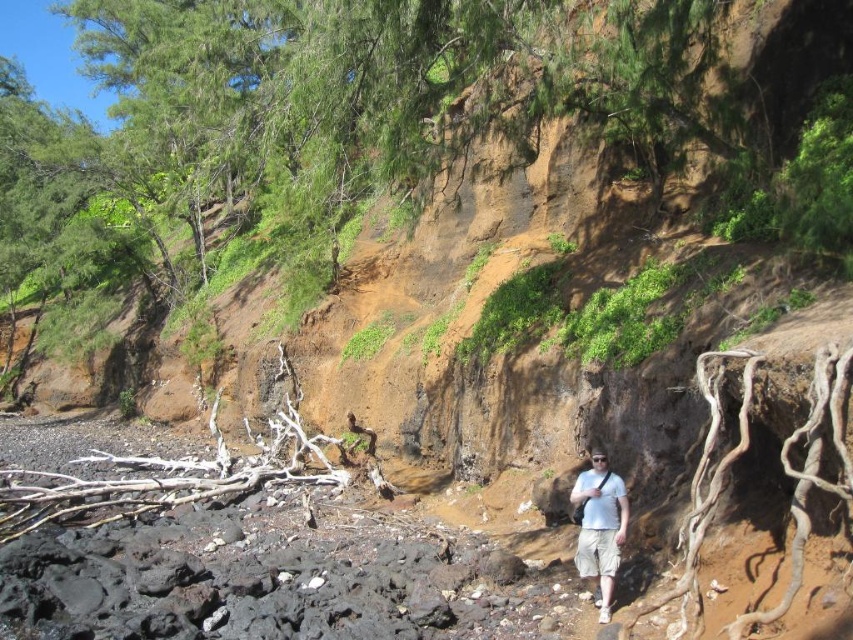
Is brown rough tree root at lower left closer to the viewer compared to white cotton shirt at lower right?

That is False.

Is point (86, 484) in front of point (593, 488)?

No, it is behind (593, 488).

Who is more forward, (x=223, y=486) or (x=602, y=483)?

Point (x=602, y=483) is more forward.

This screenshot has width=853, height=640. I want to click on brown rough tree root at lower left, so click(160, 480).